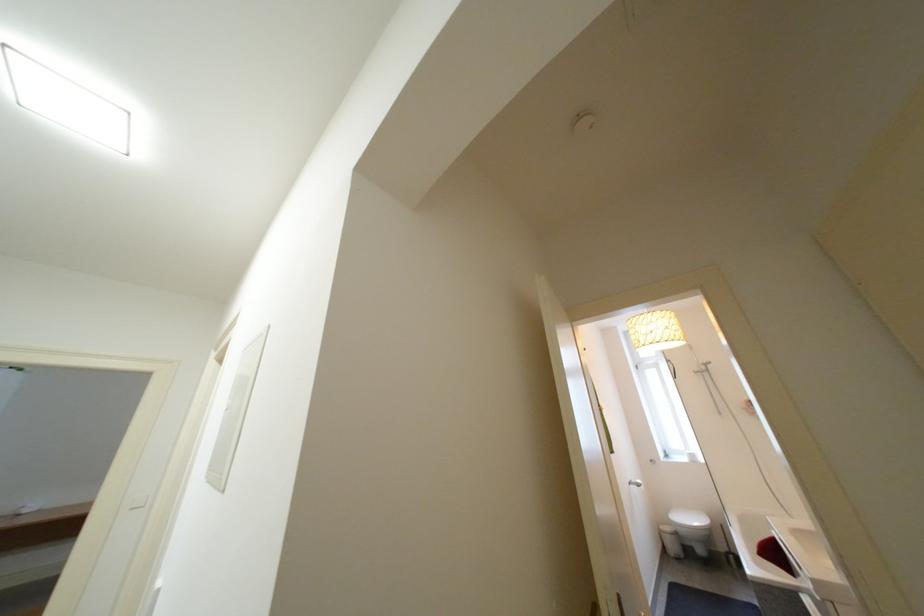
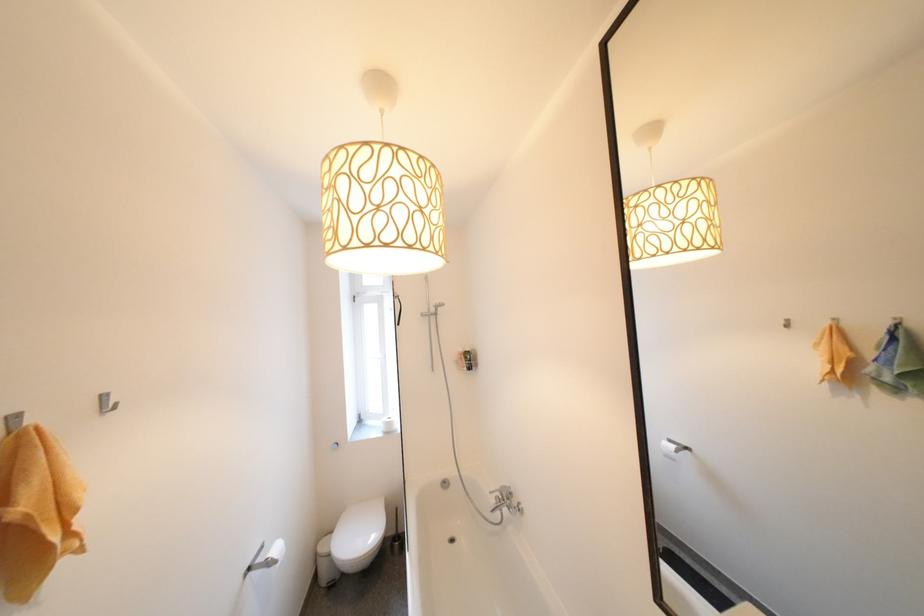
Locate, in the second image, the point that corresponds to (706,370) in the first image.

(434, 312)